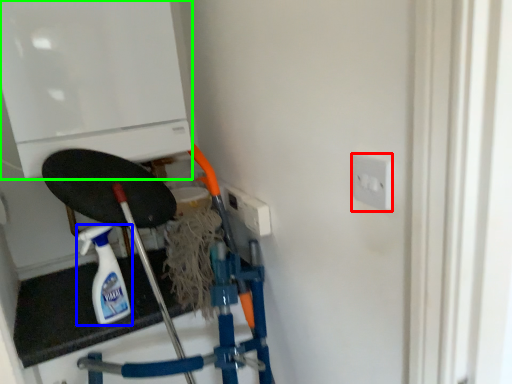
Question: Which object is the farthest from socket (highlighted by a red box)? Choose among these: bottle (highlighted by a blue box) or appliance (highlighted by a green box).

Choices:
 (A) bottle
 (B) appliance

Answer: (A)